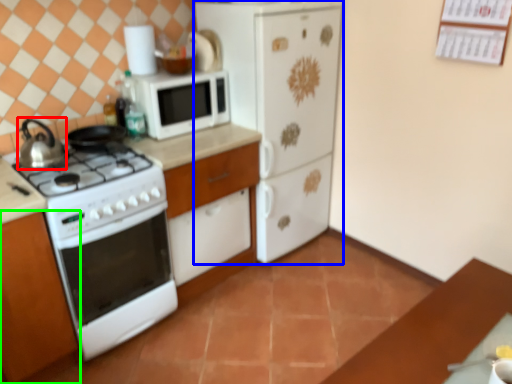
Question: Which object is positioned farthest from kitchen appliance (highlighted by a red box)? Select from home appliance (highlighted by a blue box) and cabinetry (highlighted by a green box).

Choices:
 (A) home appliance
 (B) cabinetry

Answer: (A)